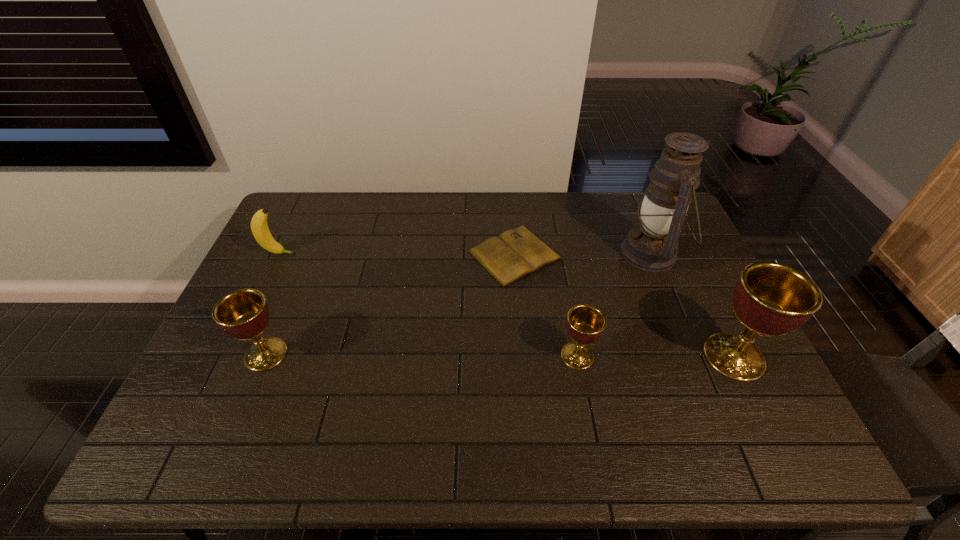
To make them evenly spaced by inserting another chalice among them, please locate a free space for this new chalice. Please provide its 2D coordinates. Your answer should be formatted as a tuple, i.e. [(x, y)], where the tuple contains the x and y coordinates of a point satisfying the conditions above.

[(421, 355)]